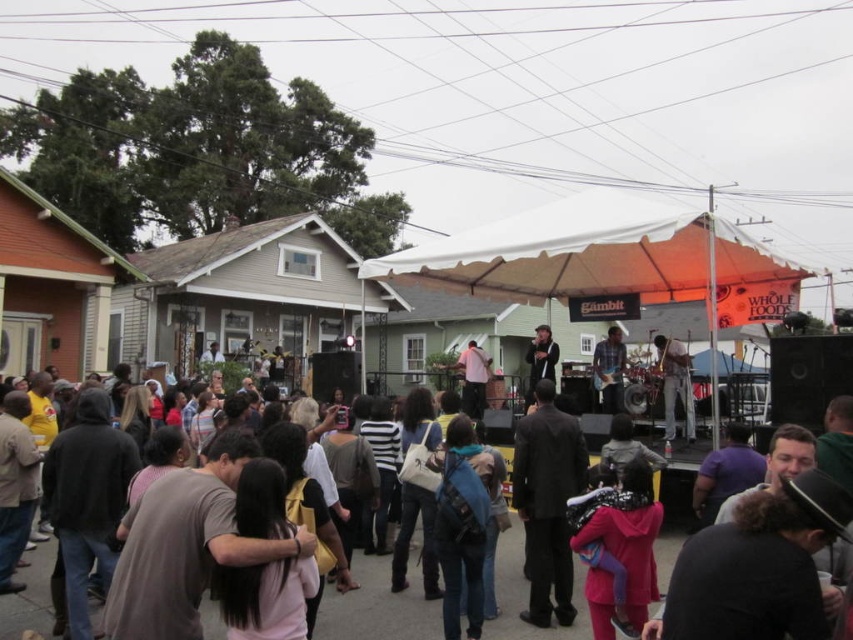
Question: Among these points, which one is farthest from the camera?

Choices:
 (A) (405, 634)
 (B) (459, 250)

Answer: (B)

Question: Is matte black jacket at center below dark gray suit at center?

Choices:
 (A) no
 (B) yes

Answer: (B)

Question: Which point appears farthest from the camera in this image?

Choices:
 (A) (527, 392)
 (B) (664, 364)

Answer: (A)

Question: Is the position of matte pink shirt at center more distant than that of matte black suit at center?

Choices:
 (A) yes
 (B) no

Answer: (A)

Question: Which point is farther from the camera taking this photo?

Choices:
 (A) (471, 403)
 (B) (560, 230)

Answer: (A)

Question: Is matte black jacket at center to the right of matte black suit at center from the viewer's perspective?

Choices:
 (A) no
 (B) yes

Answer: (A)